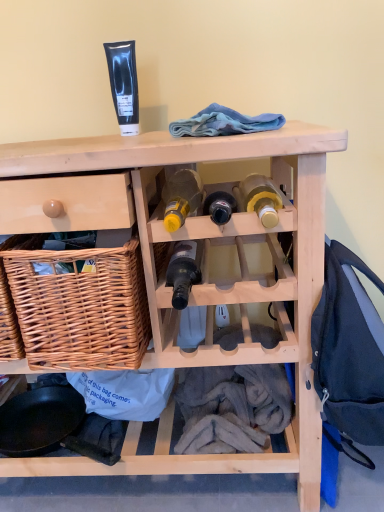
Question: In which direction should I rotate to look at blue fleece at upper center, positioned as the first clothing in top-to-bottom order?

Choices:
 (A) right
 (B) left

Answer: (A)

Question: Considering the relative sizes of matte yellow glass bottle at center, the first bottle from the right, and yellow glass bottle at center, the third bottle viewed from the right, in the image provided, is matte yellow glass bottle at center, the first bottle from the right, smaller than yellow glass bottle at center, the third bottle viewed from the right,?

Choices:
 (A) no
 (B) yes

Answer: (B)

Question: Is the position of matte yellow glass bottle at center, the first bottle from the right, more distant than that of yellow glass bottle at center, the third bottle viewed from the right?

Choices:
 (A) yes
 (B) no

Answer: (B)

Question: Is matte yellow glass bottle at center, the first bottle from the right, at the left side of yellow glass bottle at center, the first bottle when ordered from left to right?

Choices:
 (A) yes
 (B) no

Answer: (B)

Question: Can you confirm if matte yellow glass bottle at center, the first bottle from the right, is taller than yellow glass bottle at center, the first bottle when ordered from left to right?

Choices:
 (A) no
 (B) yes

Answer: (A)

Question: Can you confirm if matte yellow glass bottle at center, arranged as the 3th bottle when viewed from the left, is positioned to the right of yellow glass bottle at center, the first bottle when ordered from left to right?

Choices:
 (A) no
 (B) yes

Answer: (B)

Question: Can you confirm if matte yellow glass bottle at center, the first bottle from the right, is wider than yellow glass bottle at center, the third bottle viewed from the right?

Choices:
 (A) no
 (B) yes

Answer: (B)

Question: From the image's perspective, is matte yellow glass bottle at center, the first bottle from the right, above natural wood wine rack at center?

Choices:
 (A) no
 (B) yes

Answer: (B)

Question: Does matte yellow glass bottle at center, arranged as the 3th bottle when viewed from the left, touch natural wood wine rack at center?

Choices:
 (A) no
 (B) yes

Answer: (A)

Question: From a real-world perspective, does matte yellow glass bottle at center, the first bottle from the right, stand above natural wood wine rack at center?

Choices:
 (A) yes
 (B) no

Answer: (A)

Question: Does matte yellow glass bottle at center, arranged as the 3th bottle when viewed from the left, have a larger size compared to natural wood wine rack at center?

Choices:
 (A) yes
 (B) no

Answer: (B)

Question: Is matte yellow glass bottle at center, the first bottle from the right, at the left side of natural wood wine rack at center?

Choices:
 (A) no
 (B) yes

Answer: (A)

Question: Considering the relative sizes of matte yellow glass bottle at center, the first bottle from the right, and natural wood wine rack at center in the image provided, is matte yellow glass bottle at center, the first bottle from the right, shorter than natural wood wine rack at center?

Choices:
 (A) no
 (B) yes

Answer: (B)

Question: Is translucent glass wine bottle at center, the second bottle in the left-to-right sequence, at the right side of dark blue backpack at right, which is the 2th clothing from left to right?

Choices:
 (A) no
 (B) yes

Answer: (A)